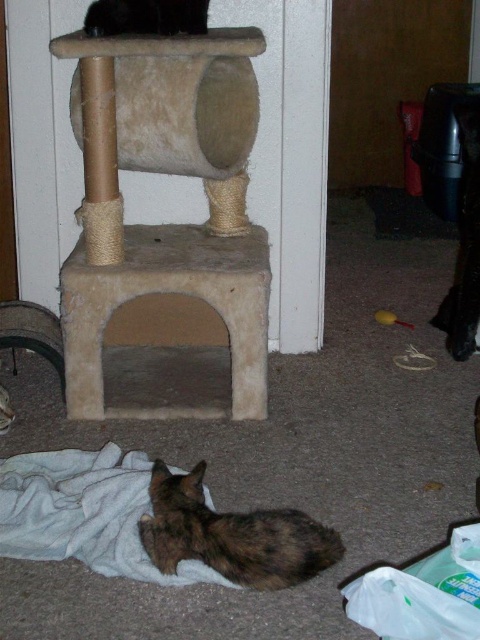
You are a cat owner who wants to place a new cat tree in the room. The current cat tree is located at point (231, 536). Where should you place the new cat tree so that it is not too close to the brown fur cat at lower center?

The new cat tree should be placed away from the brown fur cat at lower center, which is currently at point (231, 536). Consider positioning it in an area where the cat isn

You are a cat owner who wants to buy a new cat bed. The current cat bed is just big enough for the brown fur cat at lower center. Do you think the black fur cat at upper center will fit comfortably in the same bed?

The brown fur cat at lower center is bigger than the black fur cat at upper center, so the black fur cat at upper center should fit comfortably in the bed designed for the larger cat.